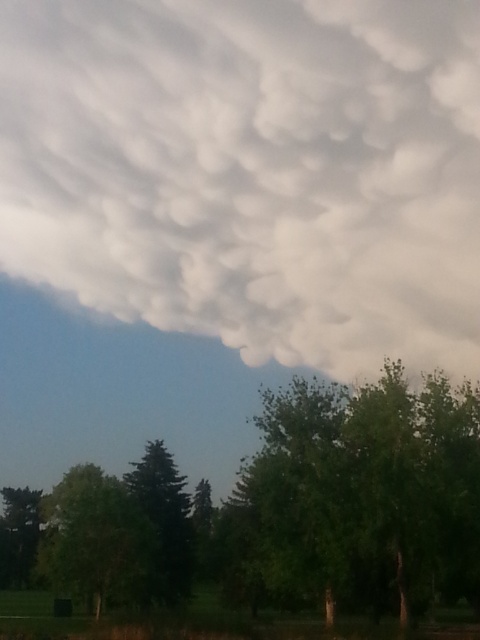
Question: Which point is closer to the camera taking this photo?

Choices:
 (A) click(x=23, y=557)
 (B) click(x=186, y=577)
 (C) click(x=86, y=474)
 (D) click(x=424, y=536)

Answer: (D)

Question: Which point is farther to the camera?

Choices:
 (A) (108, 515)
 (B) (425, 257)
 (C) (144, 499)
 (D) (262, 596)

Answer: (B)

Question: Is green leafy tree at center to the right of green matte tree at lower left from the viewer's perspective?

Choices:
 (A) no
 (B) yes

Answer: (B)

Question: Among these objects, which one is farthest from the camera?

Choices:
 (A) white fluffy cloud at upper center
 (B) green matte tree at center
 (C) green leafy tree at center

Answer: (B)

Question: From the image, what is the correct spatial relationship of white fluffy cloud at upper center in relation to green matte tree at lower left?

Choices:
 (A) below
 (B) above

Answer: (B)

Question: Does white fluffy cloud at upper center appear on the left side of green leafy tree at center?

Choices:
 (A) no
 (B) yes

Answer: (B)